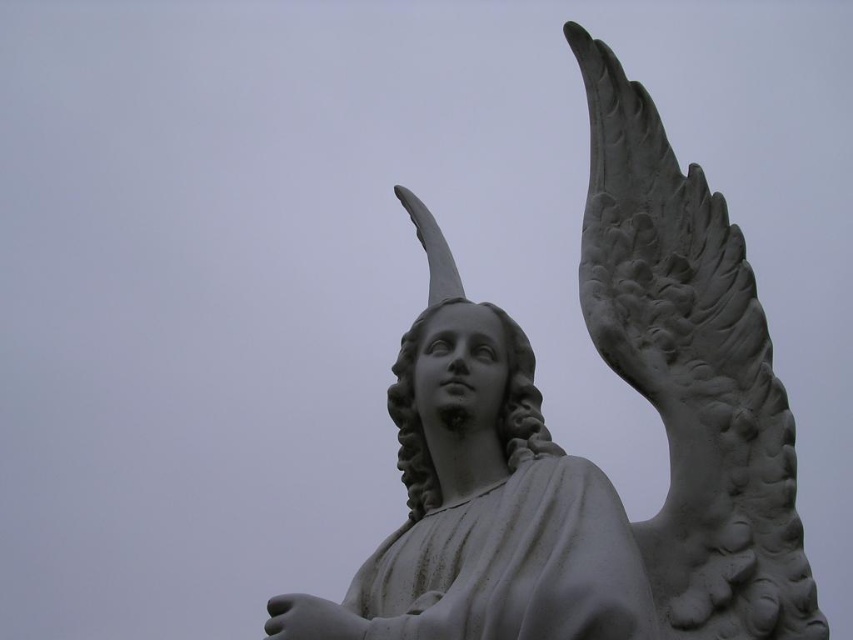
Is white stone wing at upper right positioned at the back of white stone statue at center?

No, white stone wing at upper right is in front of white stone statue at center.

How distant is white stone wing at upper right from white stone statue at center?

A distance of 1.00 meters exists between white stone wing at upper right and white stone statue at center.

Does point (671, 621) come in front of point (618, 346)?

Yes.

I want to click on white stone wing at upper right, so click(691, 372).